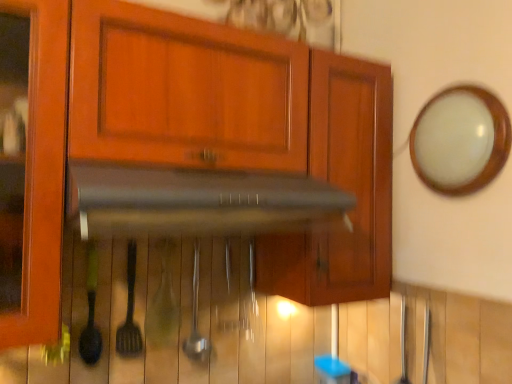
Question: Could you tell me if black matte vent at center is facing white glossy mirror at upper right?

Choices:
 (A) no
 (B) yes

Answer: (A)

Question: Considering the relative positions of black matte vent at center and white glossy mirror at upper right in the image provided, is black matte vent at center to the right of white glossy mirror at upper right from the viewer's perspective?

Choices:
 (A) no
 (B) yes

Answer: (A)

Question: Would you say black matte vent at center is outside white glossy mirror at upper right?

Choices:
 (A) no
 (B) yes

Answer: (B)

Question: Does black matte vent at center have a greater width compared to white glossy mirror at upper right?

Choices:
 (A) no
 (B) yes

Answer: (B)

Question: Considering the relative sizes of black matte vent at center and white glossy mirror at upper right in the image provided, is black matte vent at center shorter than white glossy mirror at upper right?

Choices:
 (A) yes
 (B) no

Answer: (A)

Question: Can you confirm if black matte vent at center is thinner than white glossy mirror at upper right?

Choices:
 (A) no
 (B) yes

Answer: (A)

Question: Is metallic spatula at center, which is counted as the 2th silverware, starting from the right, positioned in front of white glossy mirror at upper right?

Choices:
 (A) no
 (B) yes

Answer: (A)

Question: Is metallic spatula at center, positioned as the 1th silverware in left-to-right order, completely or partially outside of white glossy mirror at upper right?

Choices:
 (A) yes
 (B) no

Answer: (A)

Question: Is metallic spatula at center, which is counted as the 2th silverware, starting from the right, thinner than white glossy mirror at upper right?

Choices:
 (A) no
 (B) yes

Answer: (B)

Question: Is the position of metallic spatula at center, positioned as the 1th silverware in left-to-right order, more distant than that of white glossy mirror at upper right?

Choices:
 (A) no
 (B) yes

Answer: (B)

Question: Can you confirm if metallic spatula at center, which is counted as the 2th silverware, starting from the right, is smaller than white glossy mirror at upper right?

Choices:
 (A) no
 (B) yes

Answer: (B)

Question: From the image's perspective, is metallic spatula at center, which is counted as the 2th silverware, starting from the right, above white glossy mirror at upper right?

Choices:
 (A) yes
 (B) no

Answer: (B)

Question: Is black matte vent at center not near metallic spatula at center, which is counted as the 2th silverware, starting from the right?

Choices:
 (A) yes
 (B) no

Answer: (B)